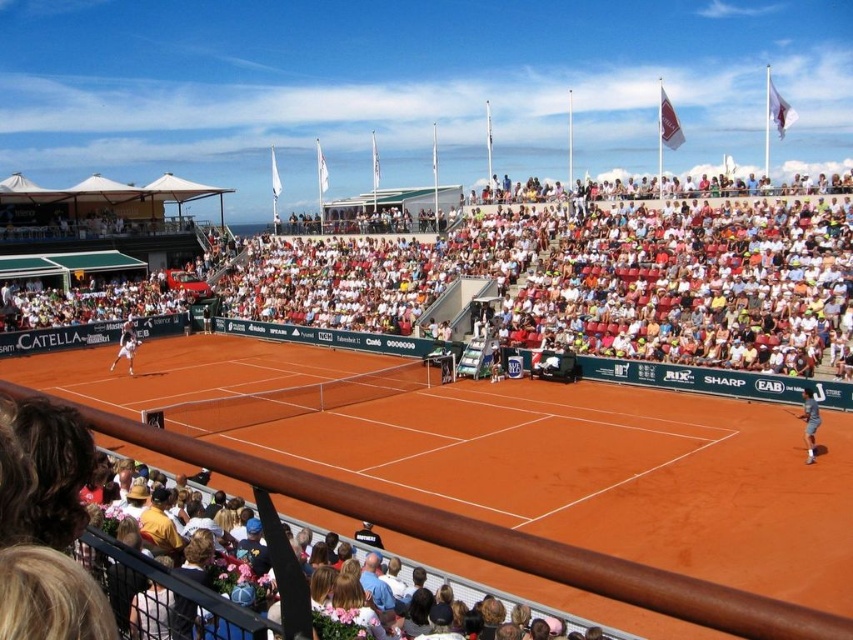
Question: Based on their relative distances, which object is farther from the white fabric seats at upper center?

Choices:
 (A) white tennis racket at right
 (B) orange clay court at center

Answer: (A)

Question: Can you confirm if orange clay court at center is wider than white tennis racket at left?

Choices:
 (A) yes
 (B) no

Answer: (A)

Question: Does white fabric seats at upper center appear on the right side of white tennis racket at right?

Choices:
 (A) no
 (B) yes

Answer: (A)

Question: Estimate the real-world distances between objects in this image. Which object is farther from the orange clay court at center?

Choices:
 (A) white tennis racket at left
 (B) white fabric seats at upper center
 (C) white tennis racket at right

Answer: (A)

Question: Which object appears closest to the camera in this image?

Choices:
 (A) white tennis racket at left
 (B) white fabric seats at upper center

Answer: (B)

Question: Is orange clay court at center behind white tennis racket at right?

Choices:
 (A) yes
 (B) no

Answer: (B)